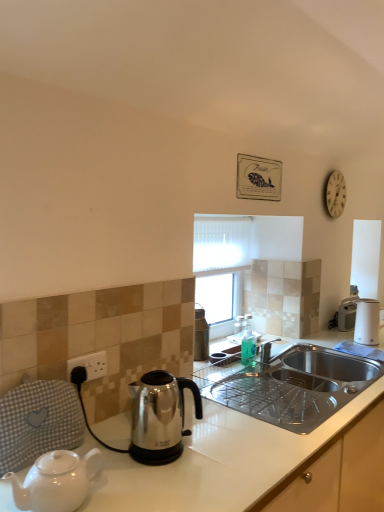
Question: Is white plastic coffee maker at right facing towards black plastic power outlet at lower left?

Choices:
 (A) no
 (B) yes

Answer: (A)

Question: Considering the relative sizes of white plastic coffee maker at right and black plastic power outlet at lower left in the image provided, is white plastic coffee maker at right shorter than black plastic power outlet at lower left?

Choices:
 (A) no
 (B) yes

Answer: (A)

Question: Can you see white plastic coffee maker at right touching black plastic power outlet at lower left?

Choices:
 (A) yes
 (B) no

Answer: (B)

Question: From a real-world perspective, is white plastic coffee maker at right under black plastic power outlet at lower left?

Choices:
 (A) yes
 (B) no

Answer: (A)

Question: Is white plastic coffee maker at right thinner than black plastic power outlet at lower left?

Choices:
 (A) no
 (B) yes

Answer: (A)

Question: Does white plastic coffee maker at right appear on the left side of black plastic power outlet at lower left?

Choices:
 (A) yes
 (B) no

Answer: (B)

Question: Is white glossy toaster at right directly adjacent to white glossy countertop at lower right?

Choices:
 (A) yes
 (B) no

Answer: (B)

Question: Considering the relative sizes of white glossy toaster at right and white glossy countertop at lower right in the image provided, is white glossy toaster at right shorter than white glossy countertop at lower right?

Choices:
 (A) no
 (B) yes

Answer: (A)

Question: From the image's perspective, is white glossy toaster at right located above white glossy countertop at lower right?

Choices:
 (A) yes
 (B) no

Answer: (A)

Question: Is white glossy toaster at right facing towards white glossy countertop at lower right?

Choices:
 (A) no
 (B) yes

Answer: (A)

Question: From the image's perspective, is white glossy toaster at right under white glossy countertop at lower right?

Choices:
 (A) no
 (B) yes

Answer: (A)

Question: Is white glossy toaster at right at the right side of white glossy countertop at lower right?

Choices:
 (A) no
 (B) yes

Answer: (B)

Question: Considering the relative sizes of white glossy countertop at lower right and black plastic power outlet at lower left in the image provided, is white glossy countertop at lower right wider than black plastic power outlet at lower left?

Choices:
 (A) yes
 (B) no

Answer: (A)